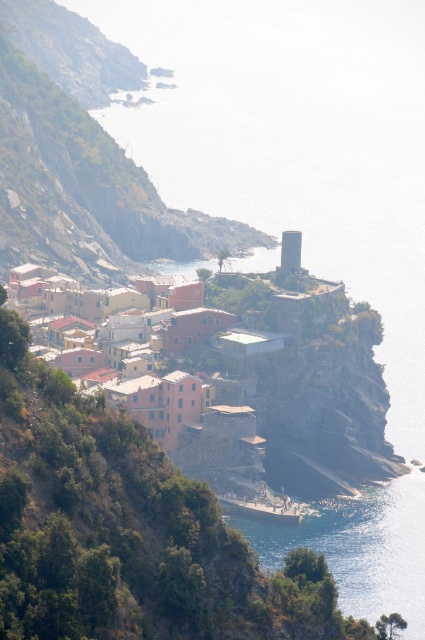
Consider the image. You are a tourist standing at the base of the cliff looking up at the village. Which of the two buildings, the rustic stone buildings at center or the matte pink buildings at center, is situated higher up?

The rustic stone buildings at center are located above the matte pink buildings at center, so they are situated higher up.

You are a tourist standing at the edge of the cliff overlooking the coastal village. You notice two groups of buildings below you. The first group is rustic stone buildings at center, and the second is matte pink buildings at center. According to the scene, which of these two groups is positioned to the left when viewed from your vantage point?

The rustic stone buildings at center are to the left of the matte pink buildings at center, so when viewed from your position at the cliff edge, the rustic stone buildings at center would appear on the left side relative to the matte pink buildings at center.

You are a tourist visiting the coastal village and want to take a photo that includes both the rustic stone buildings at center and the matte pink buildings at center. Which of these two buildings should you position closer to the camera to ensure both are fully visible in the frame?

The rustic stone buildings at center is bigger than matte pink buildings at center, so you should position the matte pink buildings at center closer to the camera to ensure both are fully visible in the frame.